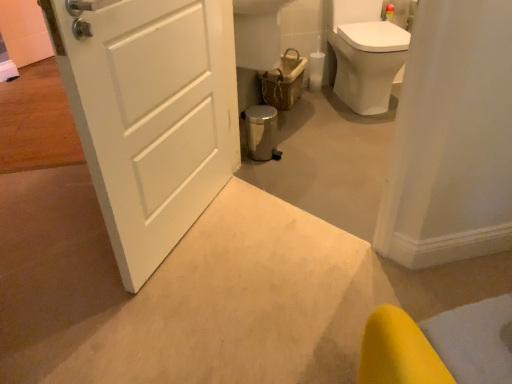
Question: Does white glossy toilet at upper right appear on the left side of white matte door at center?

Choices:
 (A) yes
 (B) no

Answer: (B)

Question: Is white glossy toilet at upper right not near white matte door at center?

Choices:
 (A) yes
 (B) no

Answer: (A)

Question: Does white glossy toilet at upper right contain white matte door at center?

Choices:
 (A) yes
 (B) no

Answer: (B)

Question: Can you confirm if white glossy toilet at upper right is thinner than white matte door at center?

Choices:
 (A) yes
 (B) no

Answer: (B)

Question: Can you confirm if white glossy toilet at upper right is bigger than white matte door at center?

Choices:
 (A) no
 (B) yes

Answer: (B)

Question: Is white glossy toilet at upper right next to white matte door at center and touching it?

Choices:
 (A) yes
 (B) no

Answer: (B)

Question: Considering the relative sizes of white glossy toilet at upper right and woven brown basket at center in the image provided, is white glossy toilet at upper right wider than woven brown basket at center?

Choices:
 (A) no
 (B) yes

Answer: (B)

Question: Considering the relative sizes of white glossy toilet at upper right and woven brown basket at center in the image provided, is white glossy toilet at upper right thinner than woven brown basket at center?

Choices:
 (A) no
 (B) yes

Answer: (A)

Question: From a real-world perspective, is white glossy toilet at upper right beneath woven brown basket at center?

Choices:
 (A) no
 (B) yes

Answer: (A)

Question: Can you confirm if white glossy toilet at upper right is taller than woven brown basket at center?

Choices:
 (A) no
 (B) yes

Answer: (B)

Question: Is white glossy toilet at upper right positioned far away from woven brown basket at center?

Choices:
 (A) yes
 (B) no

Answer: (B)

Question: Can you confirm if white glossy toilet at upper right is smaller than woven brown basket at center?

Choices:
 (A) no
 (B) yes

Answer: (A)

Question: Is woven brown basket at center facing away from white matte door at center?

Choices:
 (A) yes
 (B) no

Answer: (B)